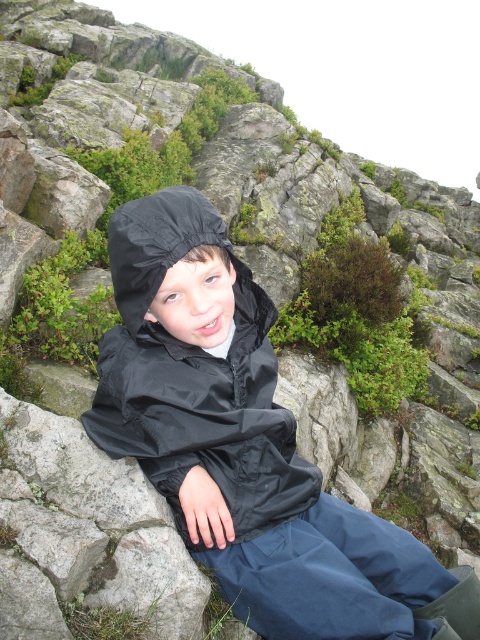
Is point (268, 621) positioned in front of point (142, 358)?

No, it is behind (142, 358).

Is point (204, 202) behind point (210, 401)?

No, it is in front of (210, 401).

Locate an element on the screen. The image size is (480, 640). black waterproof jacket at center is located at coordinates (240, 442).